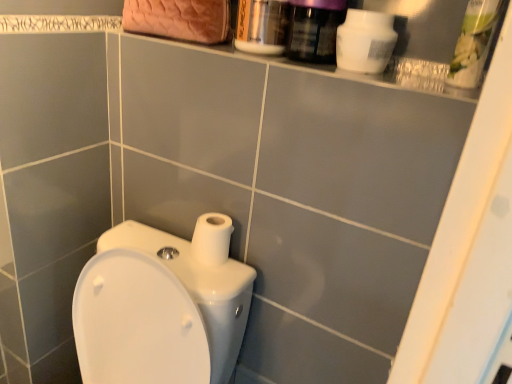
Question: Is the surface of white matte toilet paper at center in direct contact with green plastic container at upper right, arranged as the 2th cleaning product when viewed from the left?

Choices:
 (A) no
 (B) yes

Answer: (A)

Question: From a real-world perspective, is white matte toilet paper at center beneath green plastic container at upper right, arranged as the 2th cleaning product when viewed from the left?

Choices:
 (A) yes
 (B) no

Answer: (A)

Question: Considering the relative positions of white matte toilet paper at center and green plastic container at upper right, arranged as the 2th cleaning product when viewed from the left, in the image provided, is white matte toilet paper at center to the left of green plastic container at upper right, arranged as the 2th cleaning product when viewed from the left, from the viewer's perspective?

Choices:
 (A) no
 (B) yes

Answer: (B)

Question: Is white matte toilet paper at center looking in the opposite direction of green plastic container at upper right, marked as the first cleaning product in a right-to-left arrangement?

Choices:
 (A) yes
 (B) no

Answer: (B)

Question: From a real-world perspective, is white matte toilet paper at center on top of green plastic container at upper right, arranged as the 2th cleaning product when viewed from the left?

Choices:
 (A) yes
 (B) no

Answer: (B)

Question: From the image's perspective, is green plastic container at upper right, marked as the first cleaning product in a right-to-left arrangement, located above or below white matte toilet paper at center?

Choices:
 (A) above
 (B) below

Answer: (A)

Question: Considering the positions of green plastic container at upper right, marked as the first cleaning product in a right-to-left arrangement, and white matte toilet paper at center in the image, is green plastic container at upper right, marked as the first cleaning product in a right-to-left arrangement, wider or thinner than white matte toilet paper at center?

Choices:
 (A) thin
 (B) wide

Answer: (A)

Question: Is point (462, 84) closer or farther from the camera than point (211, 248)?

Choices:
 (A) closer
 (B) farther

Answer: (A)

Question: Do you think green plastic container at upper right, marked as the first cleaning product in a right-to-left arrangement, is within white matte toilet paper at center, or outside of it?

Choices:
 (A) outside
 (B) inside

Answer: (A)

Question: From the image's perspective, is white glossy toilet at lower left positioned above or below white matte bottle at upper right, marked as the 1th cleaning product in a left-to-right arrangement?

Choices:
 (A) above
 (B) below

Answer: (B)

Question: From a real-world perspective, relative to white matte bottle at upper right, which is the second cleaning product in right-to-left order, is white glossy toilet at lower left vertically above or below?

Choices:
 (A) above
 (B) below

Answer: (B)

Question: From their relative heights in the image, would you say white glossy toilet at lower left is taller or shorter than white matte bottle at upper right, marked as the 1th cleaning product in a left-to-right arrangement?

Choices:
 (A) tall
 (B) short

Answer: (A)

Question: Would you say white glossy toilet at lower left is to the left or to the right of white matte bottle at upper right, marked as the 1th cleaning product in a left-to-right arrangement, in the picture?

Choices:
 (A) right
 (B) left

Answer: (B)

Question: Considering the positions of point (202, 246) and point (359, 31), is point (202, 246) closer or farther from the camera than point (359, 31)?

Choices:
 (A) closer
 (B) farther

Answer: (B)

Question: Looking at their shapes, would you say white matte toilet paper at center is wider or thinner than white matte bottle at upper right, marked as the 1th cleaning product in a left-to-right arrangement?

Choices:
 (A) thin
 (B) wide

Answer: (B)